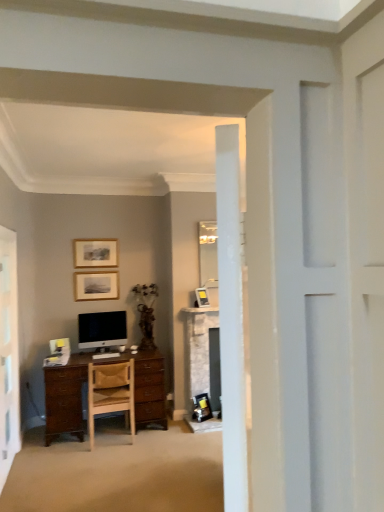
This screenshot has width=384, height=512. Identify the location of free region under wooden picture frame at upper center, the third picture frame viewed from the right (from a real-world perspective). (106, 267).